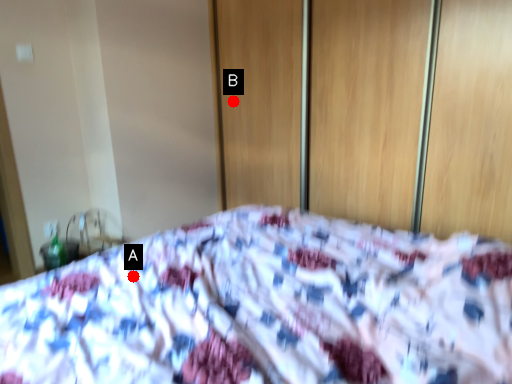
Question: Two points are circled on the image, labeled by A and B beside each circle. Which point is farther from the camera taking this photo?

Choices:
 (A) A is further
 (B) B is further

Answer: (B)